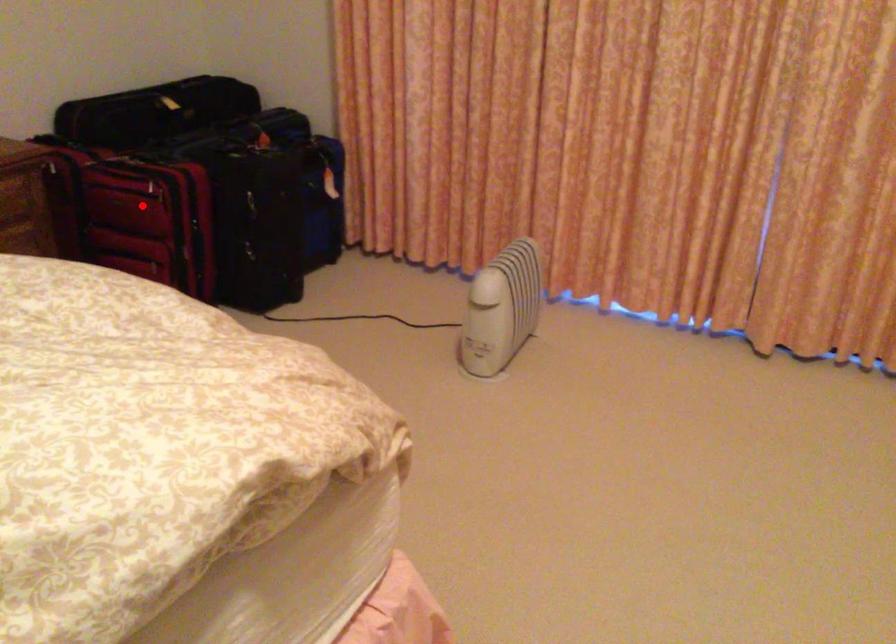
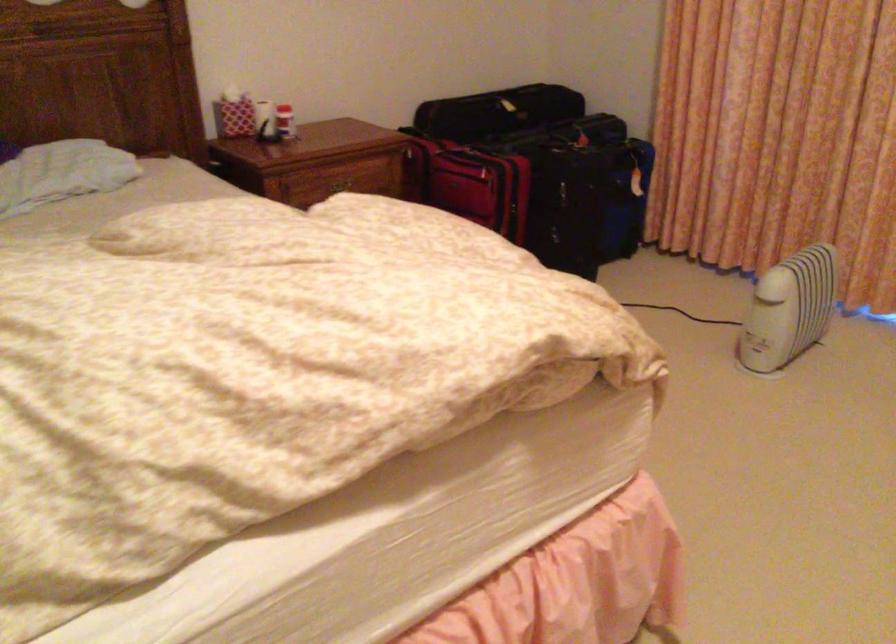
Question: I am providing you with two images of the same scene from different viewpoints. In image1, a red point is highlighted. Considering the same 3D point in image2, which of the following is correct?

Choices:
 (A) It is closer
 (B) It is farther

Answer: (B)